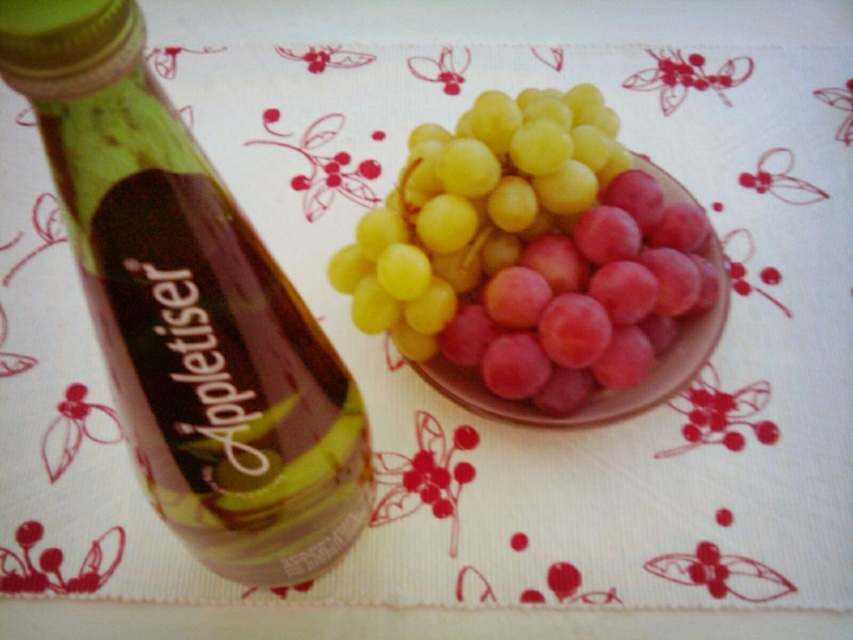
Is green glass bottle at left closer to the viewer compared to pink matte grape at center?

Yes, it is.

Is green glass bottle at left shorter than pink matte grape at center?

In fact, green glass bottle at left may be taller than pink matte grape at center.

Does point (277, 349) lie behind point (695, 348)?

No, (277, 349) is closer to viewer.

At what (x,y) coordinates should I click in order to perform the action: click on green glass bottle at left. Please return your answer as a coordinate pair (x, y). Looking at the image, I should click on (190, 308).

Is yellow matte grapes at center shorter than pink matte grape at center?

Correct, yellow matte grapes at center is not as tall as pink matte grape at center.

Locate an element on the screen. This screenshot has width=853, height=640. yellow matte grapes at center is located at coordinates (473, 205).

Find the location of a particular element. This screenshot has width=853, height=640. yellow matte grapes at center is located at coordinates (473, 205).

Find the location of a particular element. yellow matte grapes at center is located at coordinates (473, 205).

Which is more to the right, green glass bottle at left or yellow matte grapes at center?

yellow matte grapes at center

Can you confirm if green glass bottle at left is positioned above yellow matte grapes at center?

No.

Is point (57, 120) in front of point (532, 218)?

Yes, point (57, 120) is closer to viewer.

Where is `green glass bottle at left`? green glass bottle at left is located at coordinates (190, 308).